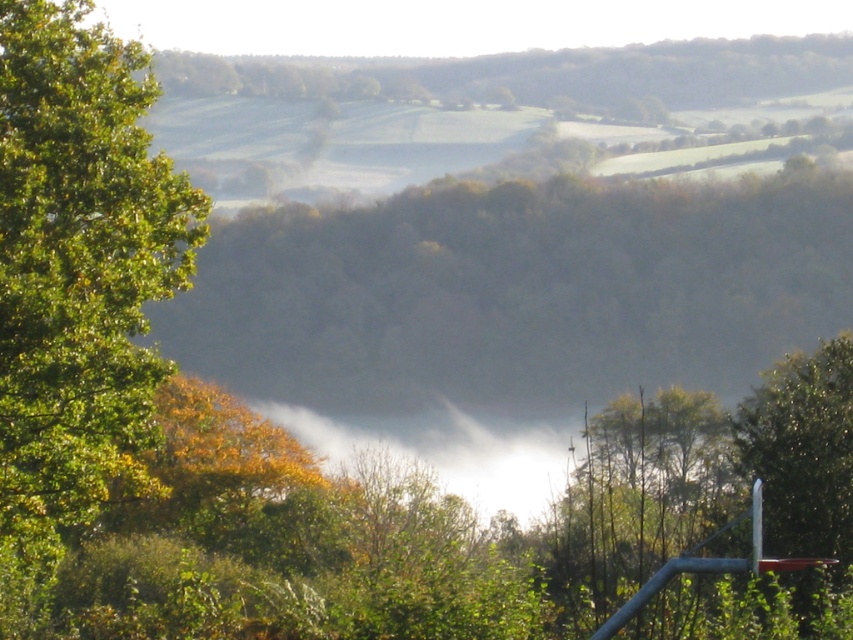
Question: Which point is farther to the camera?

Choices:
 (A) green leafy tree at left
 (B) green leafy tree at center

Answer: (B)

Question: Does green leafy tree at center appear over green leafy tree at left?

Choices:
 (A) no
 (B) yes

Answer: (B)

Question: Does green leafy tree at center lie behind green leafy tree at left?

Choices:
 (A) no
 (B) yes

Answer: (B)

Question: Which point is closer to the camera?

Choices:
 (A) green leafy tree at center
 (B) green leafy tree at left

Answer: (B)

Question: Where is green leafy tree at center located in relation to green leafy tree at left in the image?

Choices:
 (A) right
 (B) left

Answer: (A)